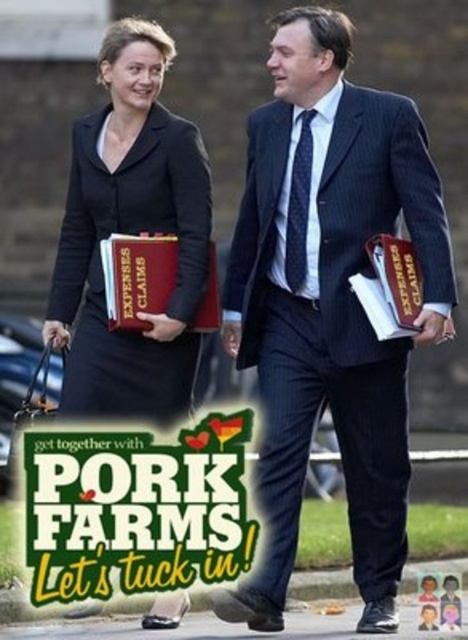
Based on the scene description, where is the dark blue pinstripe suit at center located in terms of coordinates?

The dark blue pinstripe suit at center is located at coordinates point [329,304].

You are a delivery person who needs to deliver a package to the green paper poster at center. The delivery vehicle can only approach up to 50 meters. Can you safely deliver the package?

The green paper poster at center is 57.14 meters away from camera, which is beyond the delivery vehicle maximum approach distance of 50 meters. Therefore, you cannot safely deliver the package.

You are an office assistant who needs to place both the dark blue pinstripe suit at center and the matte brown leather book at center on a shelf. The shelf has limited space, and you must ensure that the larger item is placed first to avoid overcrowding. Which item should you place first?

The dark blue pinstripe suit at center is larger in size than the matte brown leather book at center, so you should place the dark blue pinstripe suit at center first to avoid overcrowding.